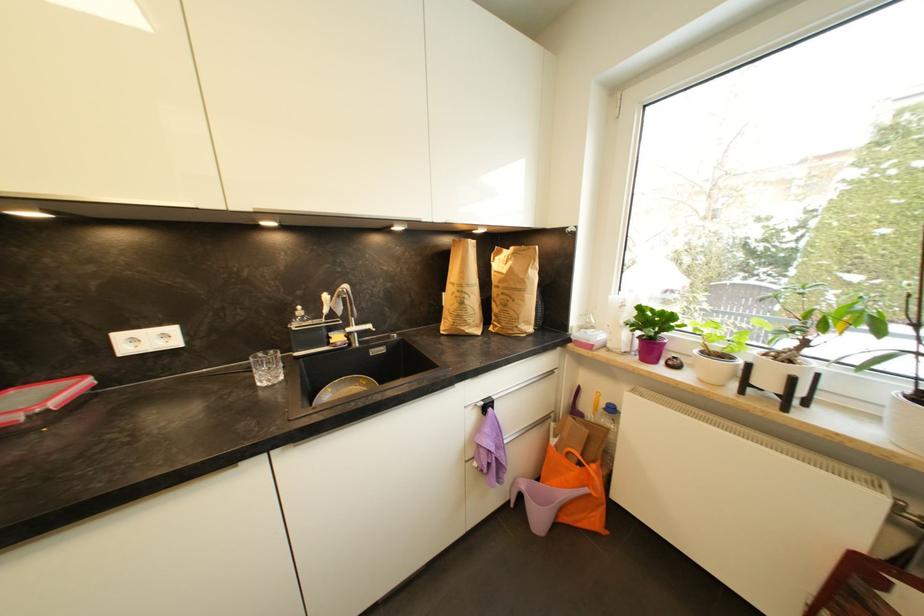
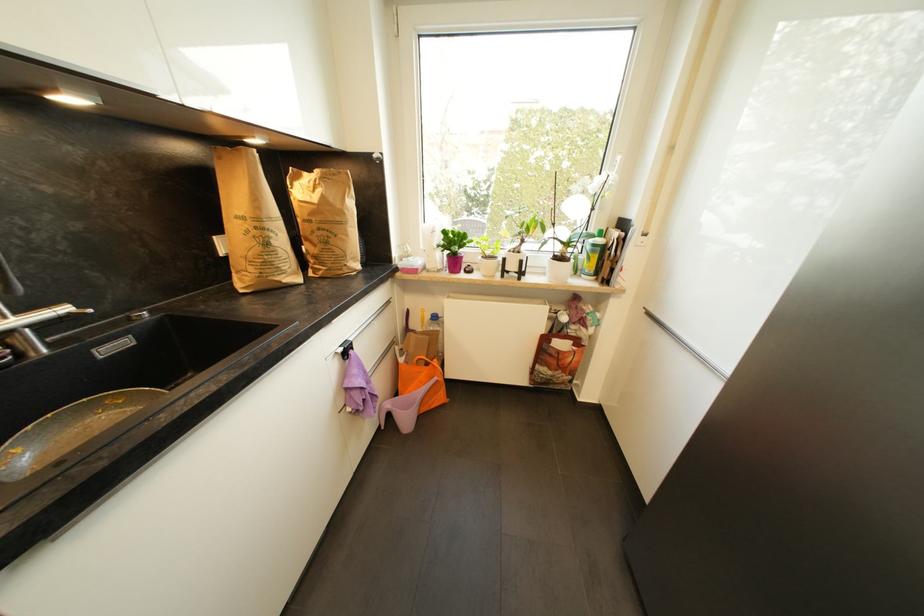
Find the pixel in the second image that matches pixel 601 523 in the first image.

(445, 399)